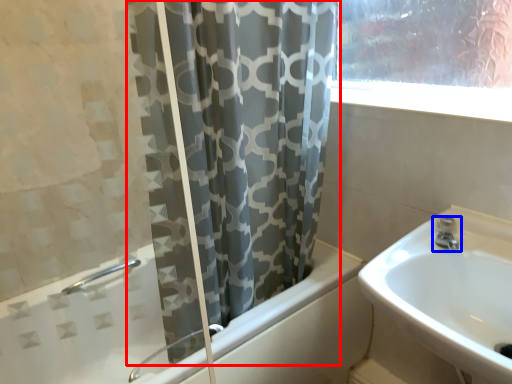
Question: Which of the following is the farthest to the observer, curtain (highlighted by a red box) or tap (highlighted by a blue box)?

Choices:
 (A) curtain
 (B) tap

Answer: (B)